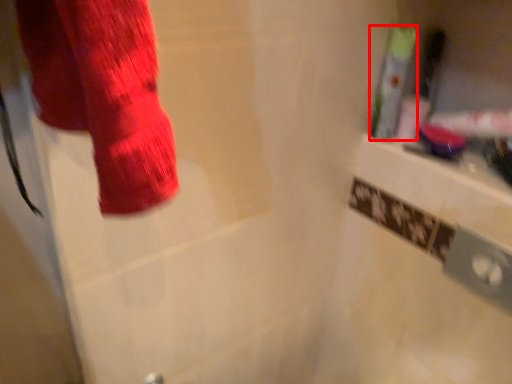
Question: Considering the relative positions of toiletry (annotated by the red box) and toiletry in the image provided, where is toiletry (annotated by the red box) located with respect to the staircase?

Choices:
 (A) right
 (B) left

Answer: (B)